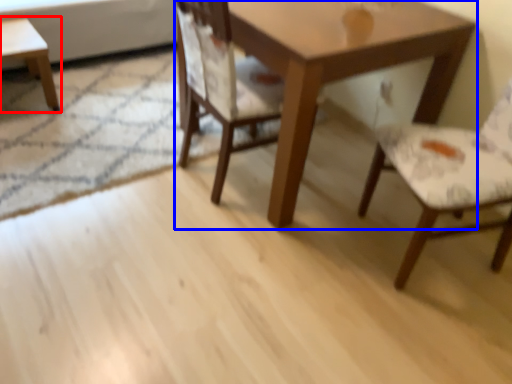
Question: Which object is closer to the camera taking this photo, coffee table (highlighted by a red box) or table (highlighted by a blue box)?

Choices:
 (A) coffee table
 (B) table

Answer: (B)